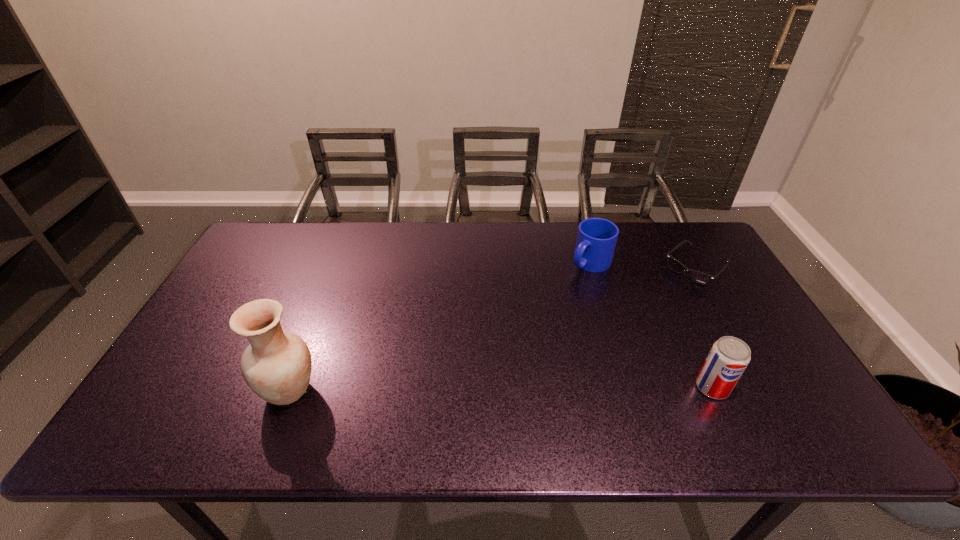
The width and height of the screenshot is (960, 540). I want to click on free space that satisfies the following two spatial constraints: 1. on the front side of the soda; 2. on the left side of the mug, so click(627, 387).

Identify the location of vacant space that satisfies the following two spatial constraints: 1. on the front side of the mug; 2. on the right side of the shortest object. The height and width of the screenshot is (540, 960). (591, 269).

Identify the location of free point that satisfies the following two spatial constraints: 1. on the back side of the soda; 2. on the right side of the shortest object. The width and height of the screenshot is (960, 540). (657, 269).